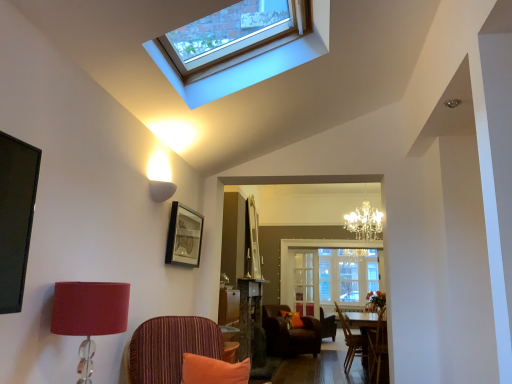
Question: Is wooden chair at right, which is counted as the 2th chair, starting from the front, located outside brown leather armchair at center, the 1th chair viewed from the back?

Choices:
 (A) no
 (B) yes

Answer: (B)

Question: Is wooden chair at right, which is counted as the 2th chair, starting from the front, to the right of brown leather armchair at center, the 1th chair viewed from the back, from the viewer's perspective?

Choices:
 (A) yes
 (B) no

Answer: (A)

Question: From a real-world perspective, is wooden chair at right, acting as the third chair starting from the back, physically above brown leather armchair at center, which is counted as the fourth chair, starting from the front?

Choices:
 (A) no
 (B) yes

Answer: (B)

Question: Is wooden chair at right, acting as the third chair starting from the back, further to the viewer compared to brown leather armchair at center, which is counted as the fourth chair, starting from the front?

Choices:
 (A) yes
 (B) no

Answer: (B)

Question: Is the depth of wooden chair at right, acting as the third chair starting from the back, less than that of brown leather armchair at center, the 1th chair viewed from the back?

Choices:
 (A) no
 (B) yes

Answer: (B)

Question: Does wooden chair at right, which is counted as the 2th chair, starting from the front, turn towards brown leather armchair at center, the 1th chair viewed from the back?

Choices:
 (A) no
 (B) yes

Answer: (A)

Question: Does striped fabric chair at center, which is counted as the 4th chair, starting from the back, turn towards wooden chair at lower right, which is the third chair from front to back?

Choices:
 (A) yes
 (B) no

Answer: (B)

Question: Would you consider striped fabric chair at center, the first chair from the front, to be distant from wooden chair at lower right, which is the third chair from front to back?

Choices:
 (A) no
 (B) yes

Answer: (B)

Question: Is wooden chair at lower right, acting as the second chair starting from the back, inside striped fabric chair at center, which is counted as the 4th chair, starting from the back?

Choices:
 (A) no
 (B) yes

Answer: (A)

Question: From a real-world perspective, is striped fabric chair at center, the first chair from the front, over wooden chair at lower right, which is the third chair from front to back?

Choices:
 (A) no
 (B) yes

Answer: (B)

Question: Does striped fabric chair at center, which is counted as the 4th chair, starting from the back, have a greater width compared to wooden chair at lower right, acting as the second chair starting from the back?

Choices:
 (A) no
 (B) yes

Answer: (B)

Question: From the image's perspective, would you say striped fabric chair at center, which is counted as the 4th chair, starting from the back, is positioned over wooden chair at lower right, which is the third chair from front to back?

Choices:
 (A) yes
 (B) no

Answer: (A)

Question: From a real-world perspective, is wooden chair at lower right, which is the third chair from front to back, located beneath striped fabric chair at center, the first chair from the front?

Choices:
 (A) yes
 (B) no

Answer: (A)